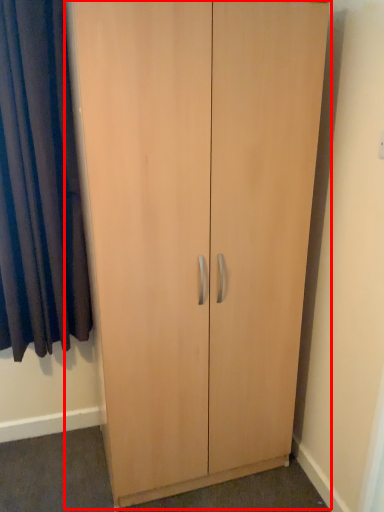
Question: From the image, what is the correct spatial relationship of cupboard (annotated by the red box) in relation to curtain?

Choices:
 (A) left
 (B) right

Answer: (B)